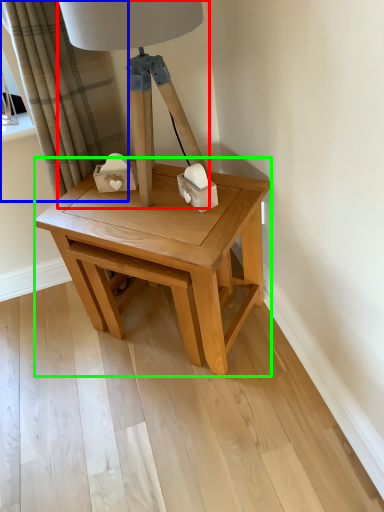
Question: Based on their relative distances, which object is farther from table lamp (highlighted by a red box)? Choose from curtain (highlighted by a blue box) and table (highlighted by a green box).

Choices:
 (A) curtain
 (B) table

Answer: (A)